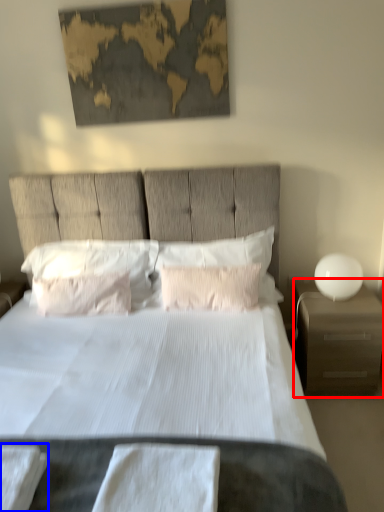
Question: Which object is closer to the camera taking this photo, nightstand (highlighted by a red box) or sheet (highlighted by a blue box)?

Choices:
 (A) nightstand
 (B) sheet

Answer: (B)